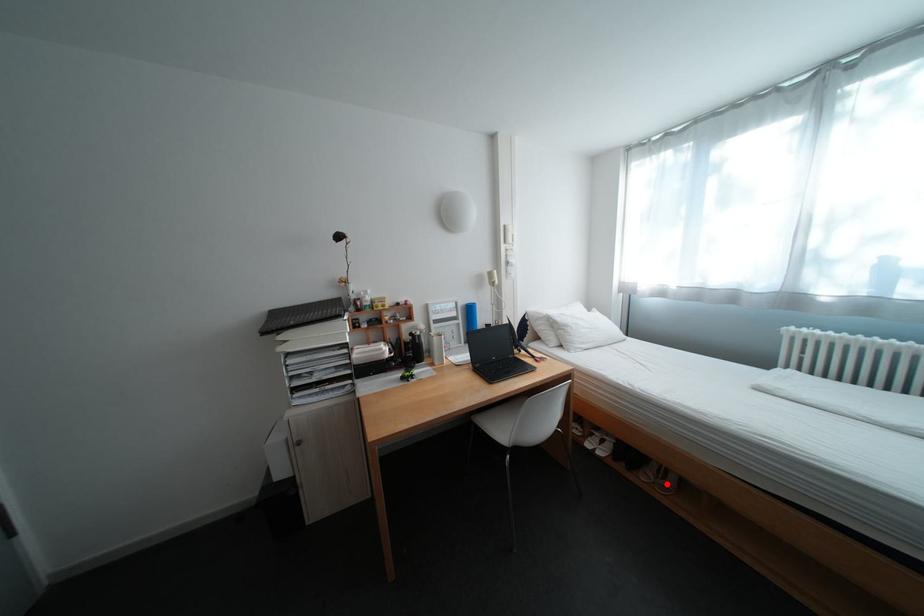
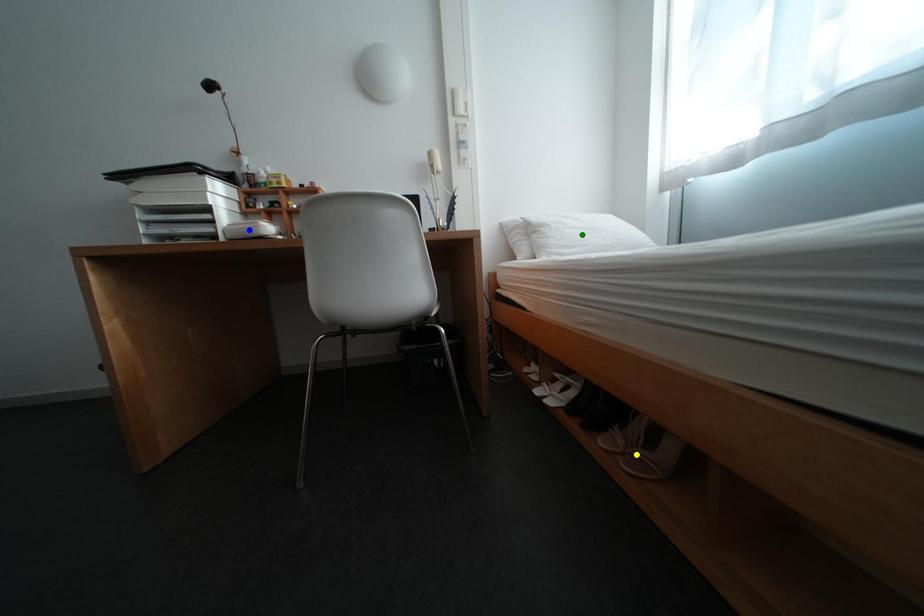
Question: I am providing you with two images of the same scene from different viewpoints. A red point is marked on the first image. You are given multiple points on the second image. In image 2, which mark is for the same physical point as the one in image 1?

Choices:
 (A) blue point
 (B) yellow point
 (C) green point

Answer: (B)